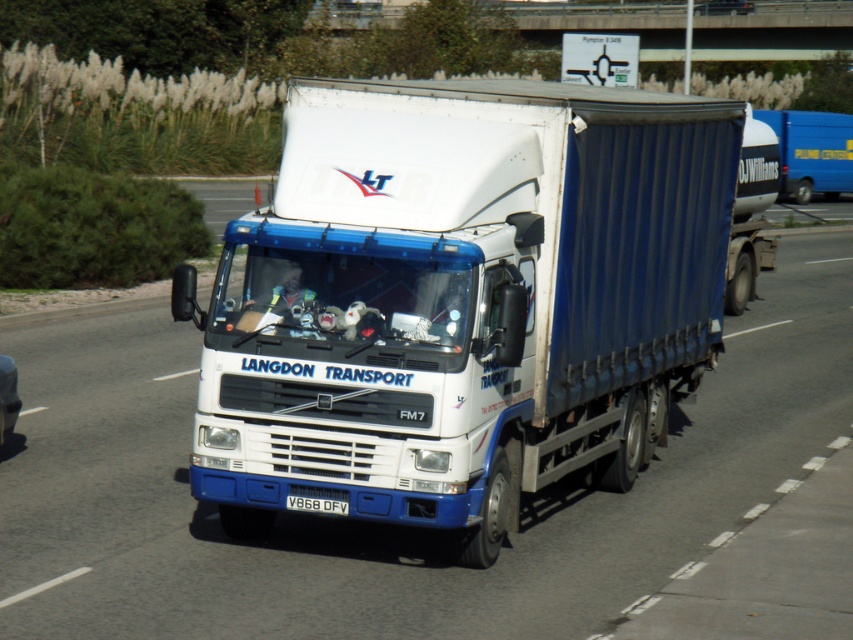
How far apart are metallic silver car at left and metallic blue truck at center?

They are 64.59 meters apart.

Is point (0, 385) farther from camera compared to point (740, 12)?

No.

Image resolution: width=853 pixels, height=640 pixels. What do you see at coordinates (7, 397) in the screenshot?
I see `metallic silver car at left` at bounding box center [7, 397].

In order to click on metallic silver car at left in this screenshot , I will do `click(7, 397)`.

This screenshot has height=640, width=853. Describe the element at coordinates (465, 298) in the screenshot. I see `white matte truck at center` at that location.

Find the location of a particular element. white matte truck at center is located at coordinates (465, 298).

Who is more forward, [703,321] or [751,10]?

Point [703,321]

Find the location of a particular element. The height and width of the screenshot is (640, 853). white matte truck at center is located at coordinates (465, 298).

Can you confirm if blue matte truck at center is positioned to the left of metallic blue truck at center?

Correct, you'll find blue matte truck at center to the left of metallic blue truck at center.

Between point (836, 176) and point (743, 8), which one is positioned in front?

Point (836, 176) is in front.

You are a GUI agent. You are given a task and a screenshot of the screen. Output one action in this format:
    pyautogui.click(x=<x>, y=<y>)
    Task: Click on the blue matte truck at center
    The width and height of the screenshot is (853, 640).
    Given the screenshot: What is the action you would take?
    [811, 150]